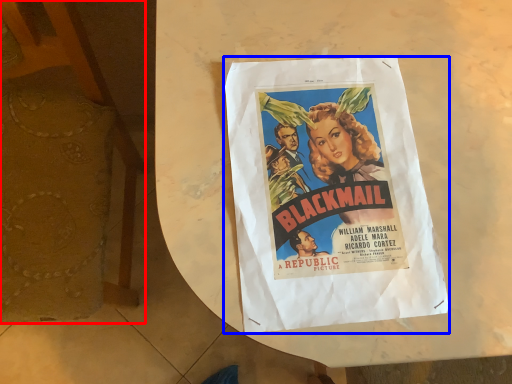
Question: Among these objects, which one is nearest to the camera, armchair (highlighted by a red box) or poster (highlighted by a blue box)?

Choices:
 (A) armchair
 (B) poster

Answer: (A)